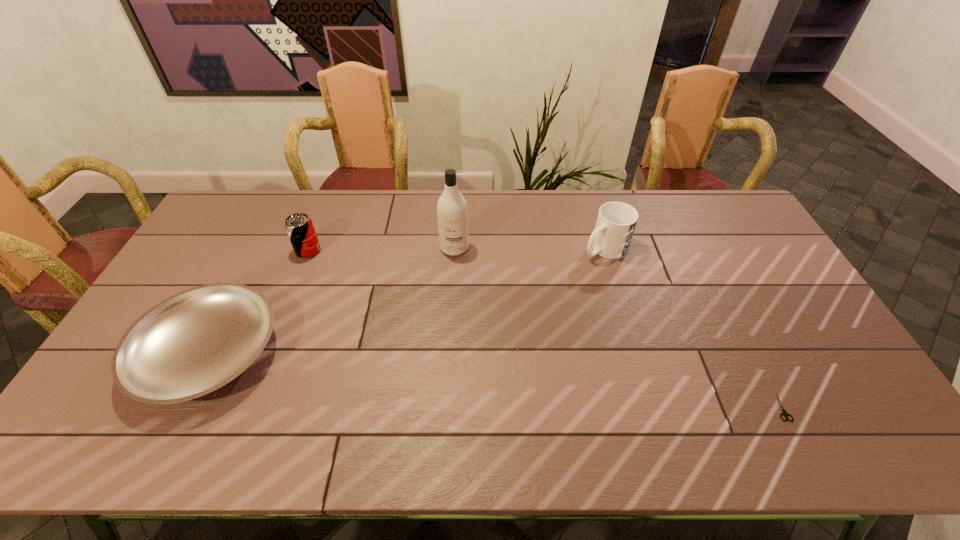
This screenshot has height=540, width=960. I want to click on shampoo, so click(452, 212).

This screenshot has height=540, width=960. In order to click on the third object from left to right in this screenshot , I will do `click(452, 212)`.

The height and width of the screenshot is (540, 960). Identify the location of mug. (616, 221).

This screenshot has width=960, height=540. Identify the location of soda can. (299, 227).

The width and height of the screenshot is (960, 540). In order to click on bedpan in this screenshot , I will do `click(193, 343)`.

Where is `the rightmost object`? the rightmost object is located at coordinates point(784,412).

The height and width of the screenshot is (540, 960). I want to click on the shortest object, so (784, 412).

At what (x,y) coordinates should I click in order to perform the action: click on free space located on the front-facing side of the tallest object. Please return your answer as a coordinate pair (x, y). Looking at the image, I should click on (449, 340).

Locate an element on the screen. vacant space located 0.180m on the back of the mug is located at coordinates coord(591,204).

This screenshot has height=540, width=960. In order to click on vacant space situated 0.340m on the left of the soda can in this screenshot , I will do `click(194, 251)`.